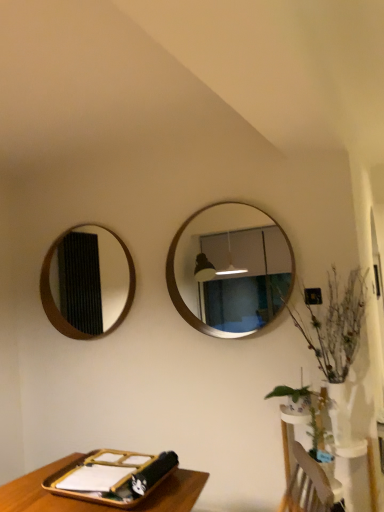
Question: Is wooden framed mirror at center, placed as the 2th mirror when sorted from left to right, inside the boundaries of green leafy plant at right, or outside?

Choices:
 (A) outside
 (B) inside

Answer: (A)

Question: From a real-world perspective, is wooden framed mirror at center, placed as the 1th mirror when sorted from right to left, positioned above or below green leafy plant at right?

Choices:
 (A) above
 (B) below

Answer: (A)

Question: Estimate the real-world distances between objects in this image. Which object is closer to the wooden mirror at left, which is the 1th mirror in left-to-right order?

Choices:
 (A) wooden tray at lower left
 (B) wooden framed mirror at center, placed as the 2th mirror when sorted from left to right
 (C) green leafy plant at right
 (D) green matte plant at lower right
 (E) white glossy vase at lower right

Answer: (B)

Question: Which is nearer to the white glossy vase at lower right?

Choices:
 (A) wooden tray at lower left
 (B) green matte plant at lower right
 (C) wooden framed mirror at center, placed as the 1th mirror when sorted from right to left
 (D) green leafy plant at right
 (E) wooden mirror at left, which is the 1th mirror in left-to-right order

Answer: (B)